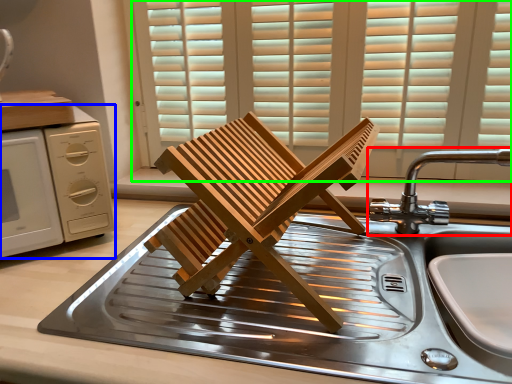
Question: Estimate the real-world distances between objects in this image. Which object is closer to tap (highlighted by a red box), home appliance (highlighted by a blue box) or window (highlighted by a green box)?

Choices:
 (A) home appliance
 (B) window

Answer: (B)